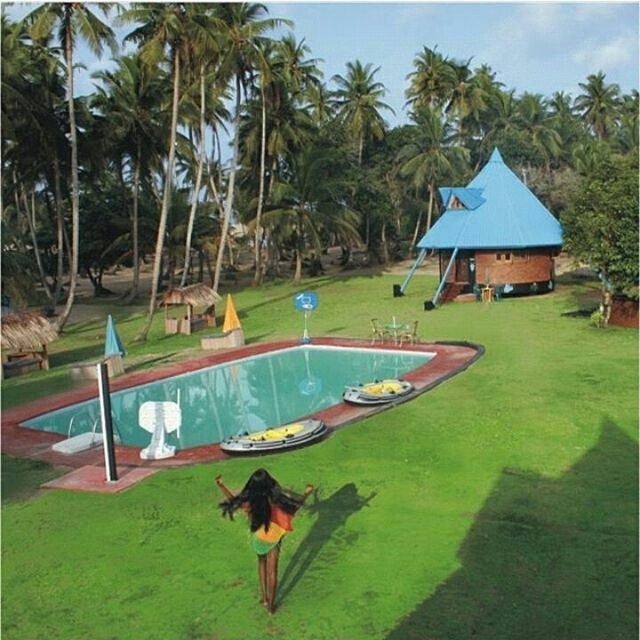
Is blue brick hut at upper right positioned before green leafy palm tree at upper right?

That is True.

Is point (540, 209) farther from camera compared to point (589, 131)?

That is False.

Locate an element on the screen. This screenshot has height=640, width=640. blue brick hut at upper right is located at coordinates (492, 236).

Is point (262, 483) farther from camera compared to point (596, 100)?

No.

Does rainbow fabric dress at center come behind green leafy palm tree at upper right?

No.

The width and height of the screenshot is (640, 640). What do you see at coordinates (264, 522) in the screenshot?
I see `rainbow fabric dress at center` at bounding box center [264, 522].

Locate an element on the screen. The width and height of the screenshot is (640, 640). rainbow fabric dress at center is located at coordinates (264, 522).

Which is behind, point (230, 544) or point (461, 186)?

Positioned behind is point (461, 186).

Is point (548, 492) closer to camera compared to point (483, 228)?

Yes, point (548, 492) is closer to viewer.

Does point (636, 504) come farther from viewer compared to point (547, 211)?

No.

Find the location of a particular element. The height and width of the screenshot is (640, 640). green grass at lower center is located at coordinates (380, 506).